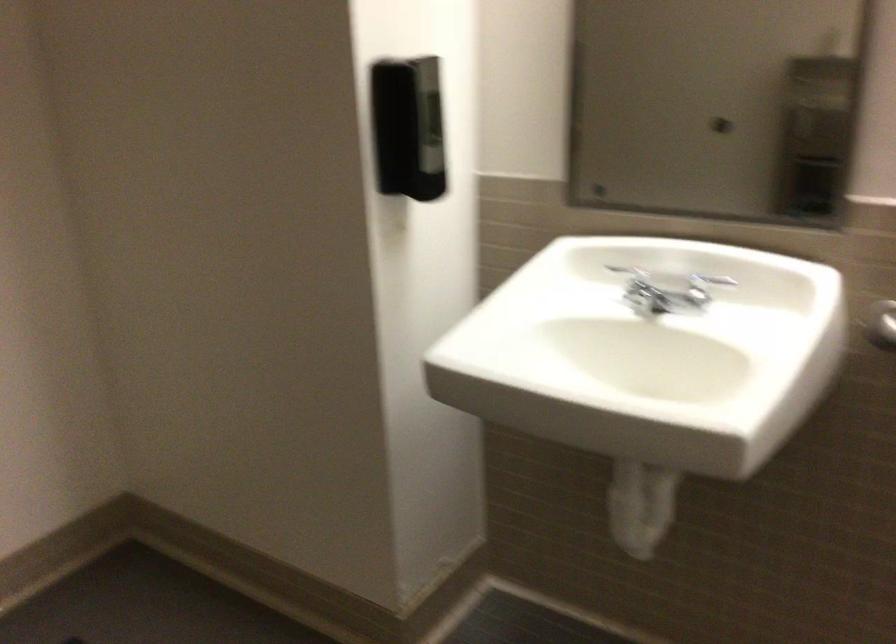
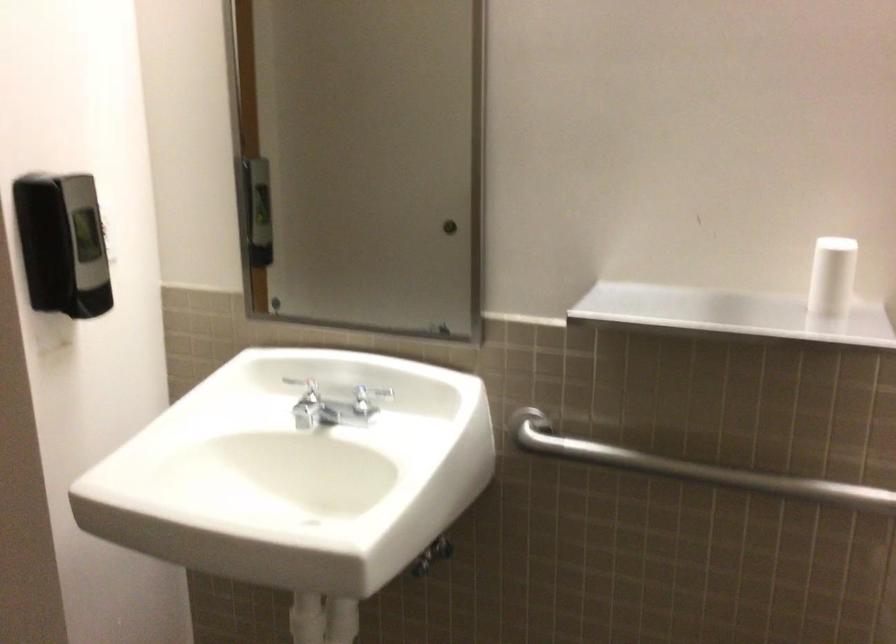
The point at (631, 272) is marked in the first image. Where is the corresponding point in the second image?

(305, 389)